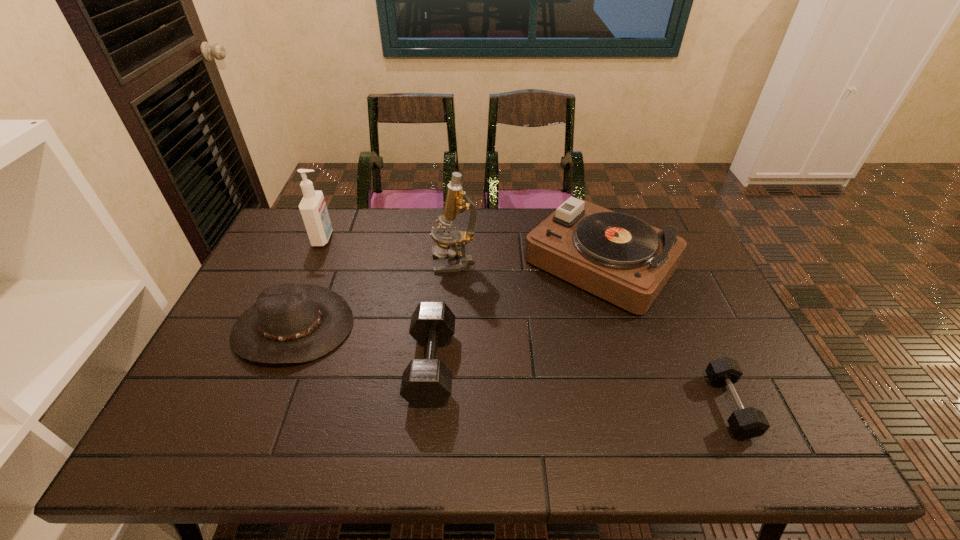
Identify the location of the tallest object. (444, 235).

Where is `cleansing agent`? This screenshot has width=960, height=540. cleansing agent is located at coordinates (313, 209).

The width and height of the screenshot is (960, 540). What are the coordinates of `record player` in the screenshot? It's located at (620, 258).

Where is `hat`? This screenshot has height=540, width=960. hat is located at coordinates (290, 323).

The image size is (960, 540). What are the coordinates of `the left dumbbell` in the screenshot? It's located at (426, 383).

At what (x,y) coordinates should I click in order to perform the action: click on the shortest object. Please return your answer as a coordinate pair (x, y). The width and height of the screenshot is (960, 540). Looking at the image, I should click on (747, 423).

Find the location of a particular element. This screenshot has height=540, width=960. the shorter dumbbell is located at coordinates (747, 423).

You are a GUI agent. You are given a task and a screenshot of the screen. Output one action in this format:
    pyautogui.click(x=<x>, y=<y>)
    Task: Click on the blank space located on the left of the tallest object
    The width and height of the screenshot is (960, 540).
    Given the screenshot: What is the action you would take?
    pyautogui.click(x=394, y=261)

Where is `blank area located on the front label of the fifth shortest object`? The width and height of the screenshot is (960, 540). blank area located on the front label of the fifth shortest object is located at coordinates (398, 238).

At what (x,y) coordinates should I click in order to perform the action: click on free space located 0.130m on the left of the fourth shortest object. Please return your answer as a coordinate pair (x, y). The image size is (960, 540). Looking at the image, I should click on (484, 263).